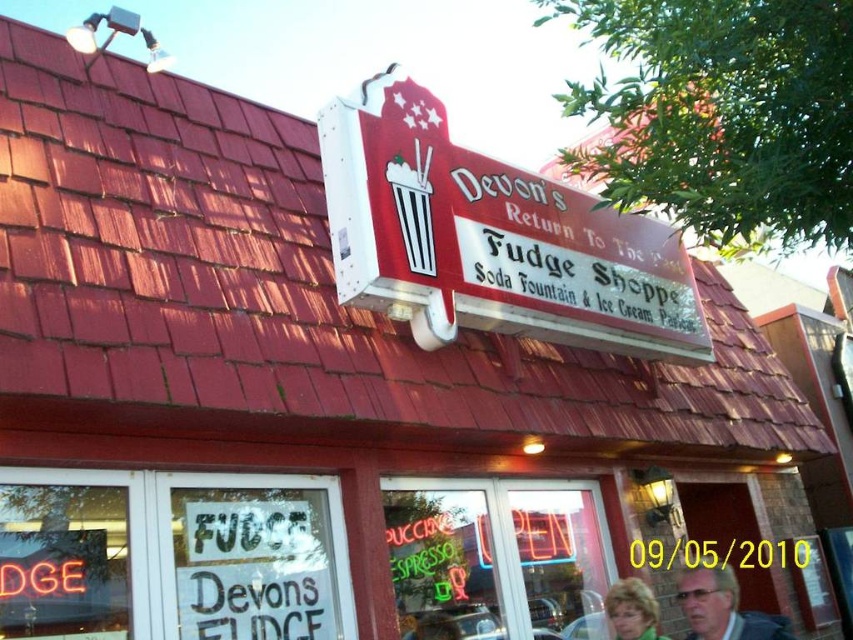
Question: Can you confirm if matte red sign at center is wider than matte gray hair at center?

Choices:
 (A) yes
 (B) no

Answer: (A)

Question: Which point is closer to the camera?

Choices:
 (A) (624, 605)
 (B) (705, 577)

Answer: (B)

Question: Is matte red sign at center smaller than blonde hair at center?

Choices:
 (A) yes
 (B) no

Answer: (B)

Question: Based on their relative distances, which object is farther from the matte gray hair at center?

Choices:
 (A) matte red sign at center
 (B) blonde hair at center

Answer: (A)

Question: Observing the image, what is the correct spatial positioning of matte gray hair at center in reference to blonde hair at center?

Choices:
 (A) right
 (B) left

Answer: (A)

Question: Which object is positioned closest to the matte red sign at center?

Choices:
 (A) matte gray hair at center
 (B) blonde hair at center

Answer: (B)